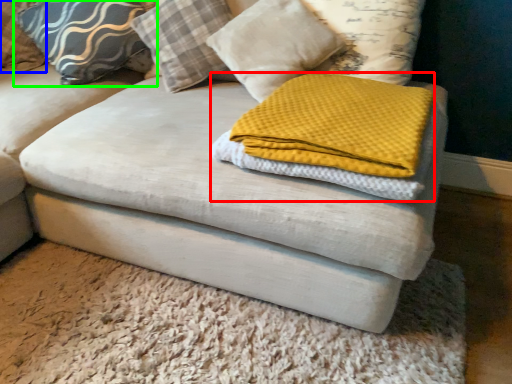
Question: Which object is the closest to the cloth (highlighted by a red box)? Choose among these: pillow (highlighted by a blue box) or pillow (highlighted by a green box).

Choices:
 (A) pillow
 (B) pillow

Answer: (B)